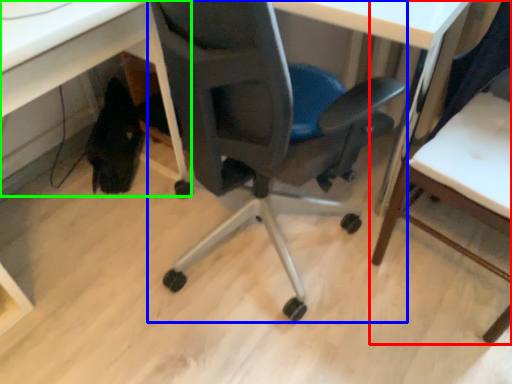
Question: Estimate the real-world distances between objects in this image. Which object is farther from chair (highlighted by a red box), chair (highlighted by a blue box) or computer desk (highlighted by a green box)?

Choices:
 (A) chair
 (B) computer desk

Answer: (B)